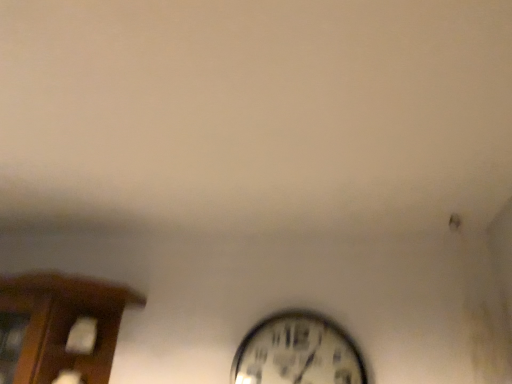
Question: Considering the relative positions of brown wood cabinet at left and metallic silver clock at lower center in the image provided, is brown wood cabinet at left behind metallic silver clock at lower center?

Choices:
 (A) yes
 (B) no

Answer: (B)

Question: Could metallic silver clock at lower center be considered to be inside brown wood cabinet at left?

Choices:
 (A) yes
 (B) no

Answer: (B)

Question: Can you confirm if brown wood cabinet at left is positioned to the right of metallic silver clock at lower center?

Choices:
 (A) no
 (B) yes

Answer: (A)

Question: Is brown wood cabinet at left facing towards metallic silver clock at lower center?

Choices:
 (A) no
 (B) yes

Answer: (A)

Question: From the image's perspective, does brown wood cabinet at left appear lower than metallic silver clock at lower center?

Choices:
 (A) no
 (B) yes

Answer: (A)

Question: Is brown wood cabinet at left at the left side of metallic silver clock at lower center?

Choices:
 (A) no
 (B) yes

Answer: (B)

Question: Considering the relative sizes of metallic silver clock at lower center and brown wood cabinet at left in the image provided, is metallic silver clock at lower center shorter than brown wood cabinet at left?

Choices:
 (A) no
 (B) yes

Answer: (B)

Question: Is metallic silver clock at lower center at the right side of brown wood cabinet at left?

Choices:
 (A) no
 (B) yes

Answer: (B)

Question: From the image's perspective, is metallic silver clock at lower center over brown wood cabinet at left?

Choices:
 (A) yes
 (B) no

Answer: (B)

Question: Is metallic silver clock at lower center closer to camera compared to brown wood cabinet at left?

Choices:
 (A) yes
 (B) no

Answer: (B)

Question: From a real-world perspective, is metallic silver clock at lower center physically below brown wood cabinet at left?

Choices:
 (A) yes
 (B) no

Answer: (B)

Question: Does metallic silver clock at lower center have a lesser width compared to brown wood cabinet at left?

Choices:
 (A) yes
 (B) no

Answer: (A)

Question: Choose the correct answer: Is brown wood cabinet at left inside metallic silver clock at lower center or outside it?

Choices:
 (A) inside
 (B) outside

Answer: (B)